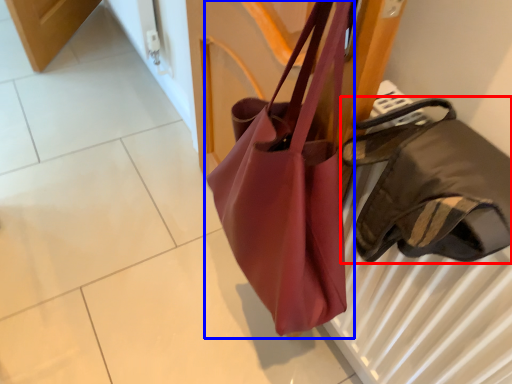
Question: Which point is further to the camera, handbag (highlighted by a red box) or handbag (highlighted by a blue box)?

Choices:
 (A) handbag
 (B) handbag

Answer: (B)